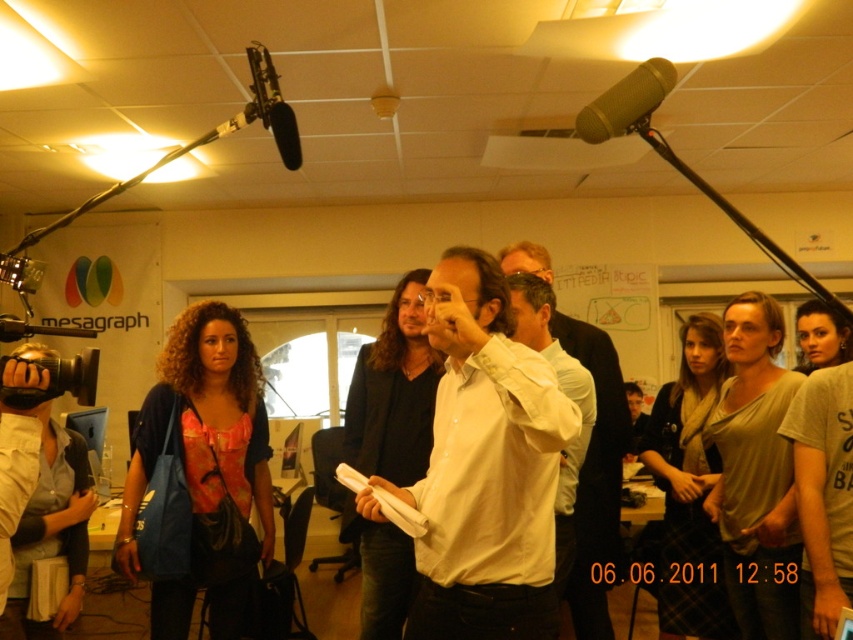
Does white shirt at center come in front of gold metallic microphone at upper center?

No, white shirt at center is behind gold metallic microphone at upper center.

Locate an element on the screen. white shirt at center is located at coordinates (596, 476).

Can you confirm if white matte shirt at center is positioned below gold metallic microphone at upper center?

Yes, white matte shirt at center is below gold metallic microphone at upper center.

Can you confirm if white matte shirt at center is wider than gold metallic microphone at upper center?

Yes, white matte shirt at center is wider than gold metallic microphone at upper center.

Find the location of a particular element. This screenshot has width=853, height=640. white matte shirt at center is located at coordinates (486, 467).

Is the position of white matte shirt at center less distant than that of white shirt at center?

Yes.

Does white matte shirt at center appear on the left side of white shirt at center?

Indeed, white matte shirt at center is positioned on the left side of white shirt at center.

This screenshot has width=853, height=640. What do you see at coordinates (486, 467) in the screenshot?
I see `white matte shirt at center` at bounding box center [486, 467].

Locate an element on the screen. white matte shirt at center is located at coordinates (486, 467).